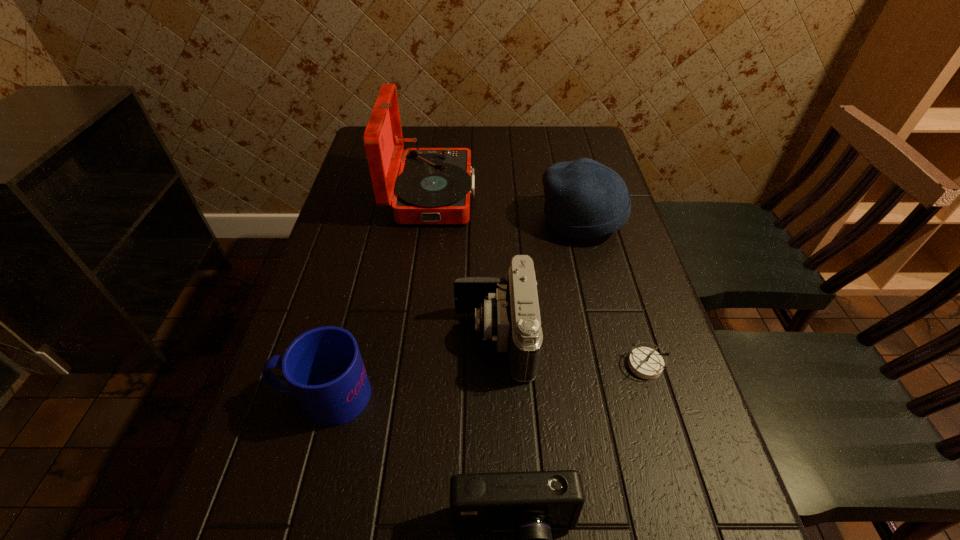
This screenshot has height=540, width=960. In order to click on vacant space located on the left of the shortest object in this screenshot , I will do [x=518, y=365].

Image resolution: width=960 pixels, height=540 pixels. What are the coordinates of `phonograph_record that is positioned at the left edge` in the screenshot? It's located at (434, 185).

Image resolution: width=960 pixels, height=540 pixels. I want to click on mug located in the left edge section of the desktop, so click(x=323, y=367).

Where is `skullcap that is at the right edge`? This screenshot has height=540, width=960. skullcap that is at the right edge is located at coordinates 584,199.

Find the location of `compass present at the right edge`. compass present at the right edge is located at coordinates (646, 363).

The image size is (960, 540). In order to click on vacant point at the far edge in this screenshot , I will do `click(482, 125)`.

At what (x,y) coordinates should I click in order to perform the action: click on vacant region at the left edge of the desktop. Please return your answer as a coordinate pair (x, y). The height and width of the screenshot is (540, 960). Looking at the image, I should click on (240, 471).

Find the location of `free spot at the right edge of the desktop`. free spot at the right edge of the desktop is located at coordinates (620, 242).

In the image, there is a desktop. Identify the location of vacant region at the far left corner. The height and width of the screenshot is (540, 960). (405, 127).

Identify the location of vacant point at the far right corner. The height and width of the screenshot is (540, 960). (548, 126).